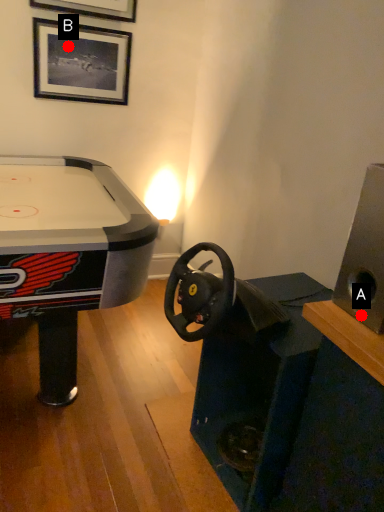
Question: Two points are circled on the image, labeled by A and B beside each circle. Which point is closer to the camera?

Choices:
 (A) A is closer
 (B) B is closer

Answer: (A)